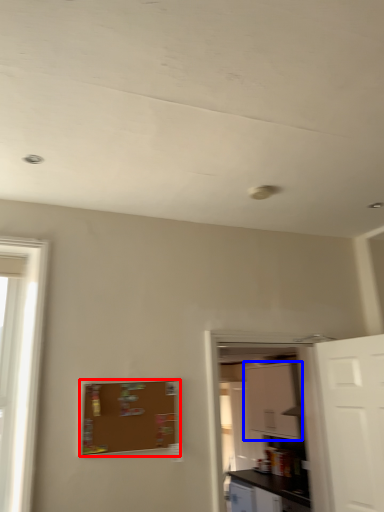
Question: Which of the following is the farthest to the observer, bulletin board (highlighted by a red box) or cabinetry (highlighted by a blue box)?

Choices:
 (A) bulletin board
 (B) cabinetry

Answer: (B)